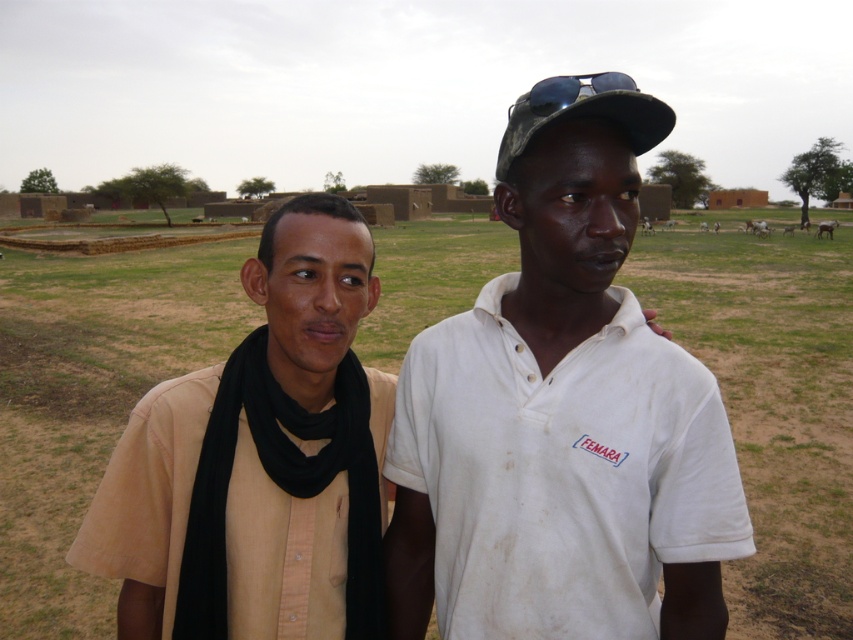
Identify the location of beige fabric shirt at center. This screenshot has height=640, width=853. (772, 401).

Is beige fabric shirt at center above camouflage fabric baseball cap at upper center?

Correct, beige fabric shirt at center is located above camouflage fabric baseball cap at upper center.

Between point (799, 429) and point (590, 99), which one is positioned behind?

The point (799, 429) is behind.

At what (x,y) coordinates should I click in order to perform the action: click on beige fabric shirt at center. Please return your answer as a coordinate pair (x, y). Image resolution: width=853 pixels, height=640 pixels. Looking at the image, I should click on (772, 401).

Between beige cotton shirt at left and camouflage fabric baseball cap at upper center, which one has less height?

beige cotton shirt at left

Does beige cotton shirt at left have a greater height compared to camouflage fabric baseball cap at upper center?

No.

Find the location of a particular element. The height and width of the screenshot is (640, 853). beige cotton shirt at left is located at coordinates (258, 460).

Find the location of a particular element. beige cotton shirt at left is located at coordinates (258, 460).

Is white cotton shirt at center to the right of beige fabric shirt at center from the viewer's perspective?

Indeed, white cotton shirt at center is positioned on the right side of beige fabric shirt at center.

In the scene shown: Measure the distance from white cotton shirt at center to beige fabric shirt at center.

The distance of white cotton shirt at center from beige fabric shirt at center is 9.77 meters.

Identify the location of white cotton shirt at center. The height and width of the screenshot is (640, 853). (561, 413).